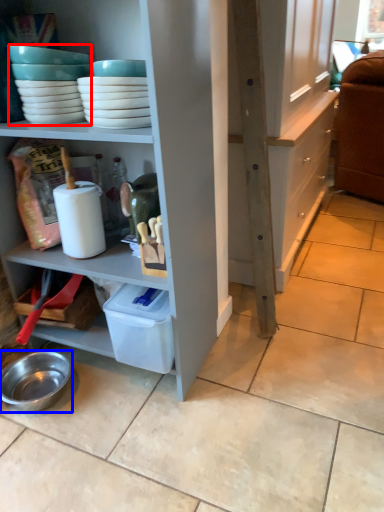
Question: Which point is further to the camera, tableware (highlighted by a red box) or bowl (highlighted by a blue box)?

Choices:
 (A) tableware
 (B) bowl

Answer: (B)